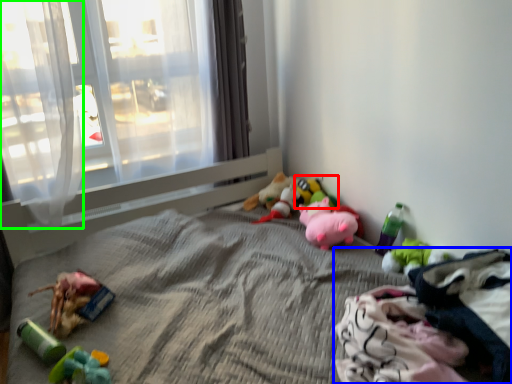
Question: Considering the real-world distances, which object is closest to toy (highlighted by a red box)? material (highlighted by a blue box) or curtain (highlighted by a green box).

Choices:
 (A) material
 (B) curtain

Answer: (A)